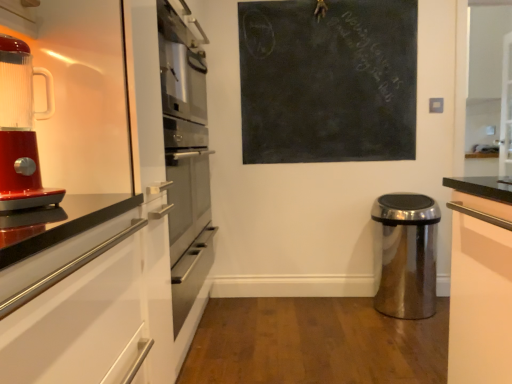
Question: Can you confirm if polished stainless steel trash can at lower right is positioned to the left of shiny red blender at left?

Choices:
 (A) yes
 (B) no

Answer: (B)

Question: From the image's perspective, does polished stainless steel trash can at lower right appear lower than shiny red blender at left?

Choices:
 (A) no
 (B) yes

Answer: (B)

Question: Is there a large distance between polished stainless steel trash can at lower right and shiny red blender at left?

Choices:
 (A) no
 (B) yes

Answer: (B)

Question: Can you confirm if polished stainless steel trash can at lower right is taller than shiny red blender at left?

Choices:
 (A) yes
 (B) no

Answer: (A)

Question: Can you confirm if polished stainless steel trash can at lower right is bigger than shiny red blender at left?

Choices:
 (A) yes
 (B) no

Answer: (A)

Question: Is polished stainless steel trash can at lower right oriented away from shiny red blender at left?

Choices:
 (A) yes
 (B) no

Answer: (B)

Question: Does shiny red blender at left have a greater width compared to polished stainless steel trash can at lower right?

Choices:
 (A) yes
 (B) no

Answer: (B)

Question: Is polished stainless steel trash can at lower right a part of shiny red blender at left?

Choices:
 (A) no
 (B) yes

Answer: (A)

Question: Is shiny red blender at left aimed at polished stainless steel trash can at lower right?

Choices:
 (A) no
 (B) yes

Answer: (A)

Question: Considering the relative positions of shiny red blender at left and polished stainless steel trash can at lower right in the image provided, is shiny red blender at left to the left of polished stainless steel trash can at lower right from the viewer's perspective?

Choices:
 (A) no
 (B) yes

Answer: (B)

Question: From the image's perspective, is shiny red blender at left above polished stainless steel trash can at lower right?

Choices:
 (A) no
 (B) yes

Answer: (B)

Question: Is shiny red blender at left at the right side of polished stainless steel trash can at lower right?

Choices:
 (A) no
 (B) yes

Answer: (A)

Question: Considering the relative sizes of black chalkboard at upper center and shiny red blender at left in the image provided, is black chalkboard at upper center taller than shiny red blender at left?

Choices:
 (A) no
 (B) yes

Answer: (B)